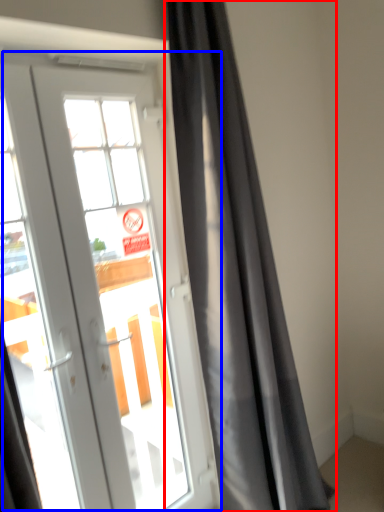
Question: Which point is further to the camera, curtain (highlighted by a red box) or door (highlighted by a blue box)?

Choices:
 (A) curtain
 (B) door

Answer: (A)